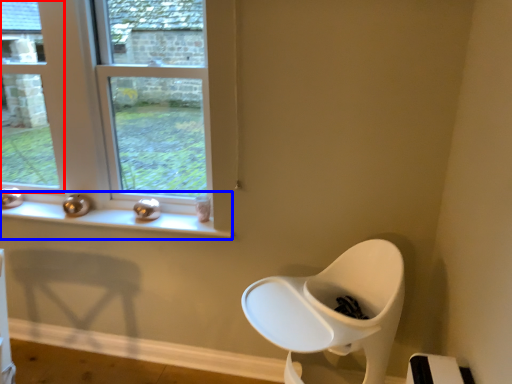
Question: Which object is closer to the camera taking this photo, window (highlighted by a red box) or window sill (highlighted by a blue box)?

Choices:
 (A) window
 (B) window sill

Answer: (B)